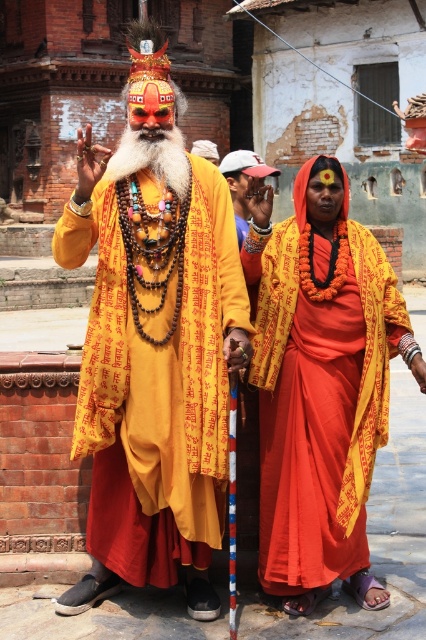
Question: Which of the following is the closest to the observer?

Choices:
 (A) matte yellow robe at center
 (B) orange silk sari at center

Answer: (A)

Question: Does matte yellow robe at center have a smaller size compared to orange silk sari at center?

Choices:
 (A) no
 (B) yes

Answer: (A)

Question: Which point is closer to the camera taking this photo?

Choices:
 (A) coord(91,200)
 (B) coord(333,525)

Answer: (A)

Question: In this image, where is matte yellow robe at center located relative to orange silk sari at center?

Choices:
 (A) below
 (B) above

Answer: (B)

Question: Among these points, which one is nearest to the camera?

Choices:
 (A) (155, 93)
 (B) (305, 211)

Answer: (A)

Question: Can you confirm if orange silk sari at center is positioned above white fluffy beard at center?

Choices:
 (A) yes
 (B) no

Answer: (B)